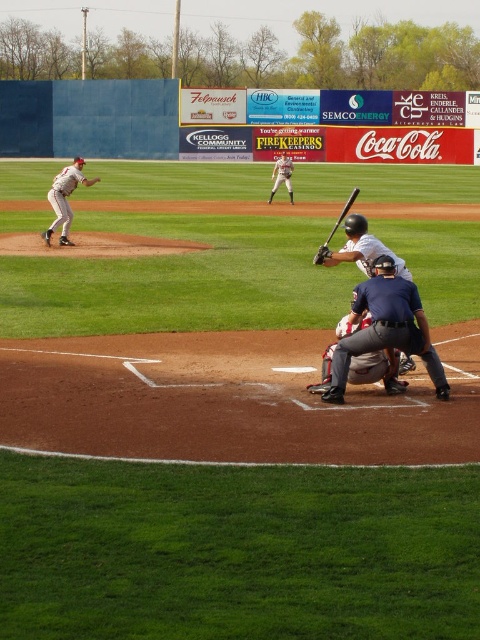
Question: Does silver metallic baseball glove at upper center appear on the right side of brown leather glove at lower center?

Choices:
 (A) no
 (B) yes

Answer: (A)

Question: Is black matte bat at center above brown leather glove at center?

Choices:
 (A) no
 (B) yes

Answer: (A)

Question: Which of these objects is positioned farthest from the black matte bat at center?

Choices:
 (A) silver metallic baseball glove at upper center
 (B) white matte baseball bat at center
 (C) dark blue uniform at center
 (D) brown leather glove at center

Answer: (D)

Question: Which object is the farthest from the silver metallic baseball glove at upper center?

Choices:
 (A) dark blue uniform at center
 (B) black matte bat at center
 (C) white uniformed pitcher at left
 (D) white matte baseball bat at center

Answer: (D)

Question: Does dark blue uniform at center have a smaller size compared to silver metallic baseball glove at upper center?

Choices:
 (A) yes
 (B) no

Answer: (A)

Question: Among these points, which one is farthest from the camera?

Choices:
 (A) (323, 260)
 (B) (66, 228)
 (C) (291, 172)
 (D) (372, 260)

Answer: (C)